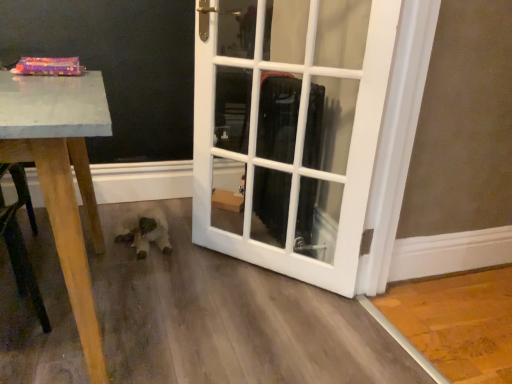
Find the location of a particular element. vacant area in front of white plush toy at lower center is located at coordinates (126, 267).